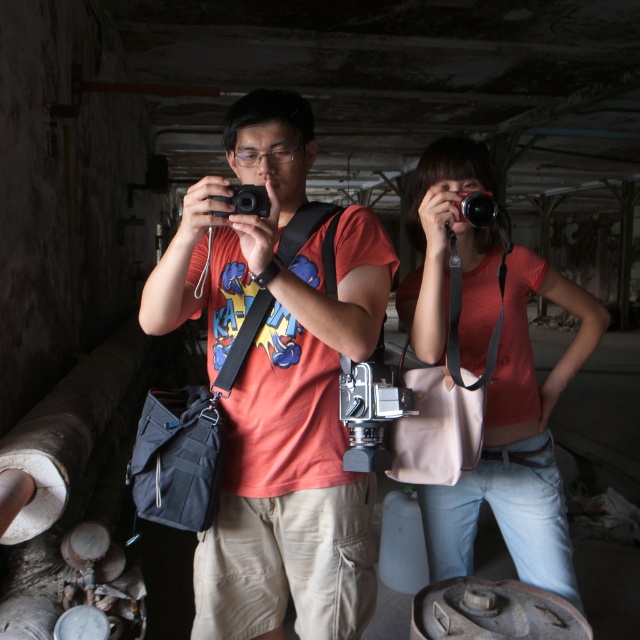
What do you see at coordinates (278, 385) in the screenshot? This screenshot has height=640, width=640. I see `matte black camera at center` at bounding box center [278, 385].

Is point (294, 300) farther from viewer compared to point (483, 216)?

That is False.

You are a GUI agent. You are given a task and a screenshot of the screen. Output one action in this format:
    pyautogui.click(x=<x>, y=<y>)
    Task: Click on the matte black camera at center
    Image resolution: width=640 pixels, height=640 pixels.
    Given the screenshot: What is the action you would take?
    pyautogui.click(x=278, y=385)

Looking at this image, which of these two, matte pink purse at center or black plastic camera at upper center, stands taller?

matte pink purse at center

The height and width of the screenshot is (640, 640). Describe the element at coordinates (516, 444) in the screenshot. I see `matte pink purse at center` at that location.

This screenshot has height=640, width=640. In order to click on matte pink purse at center in this screenshot , I will do `click(516, 444)`.

Who is more distant from viewer, (289, 369) or (470, 472)?

The point (470, 472) is more distant.

Between matte black camera at center and matte pink purse at center, which one appears on the left side from the viewer's perspective?

matte black camera at center

Find the location of a particular element. Image resolution: width=640 pixels, height=640 pixels. matte black camera at center is located at coordinates (278, 385).

Image resolution: width=640 pixels, height=640 pixels. In order to click on matte black camera at center in this screenshot , I will do `click(278, 385)`.